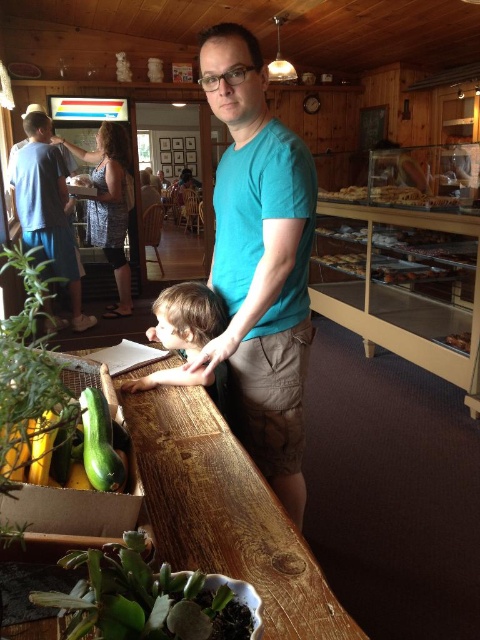
The green matte succulent at lower left is represented by point (147,598). Where is the green matte succulent located in the image?

The green matte succulent at lower left is located at point (147,598).